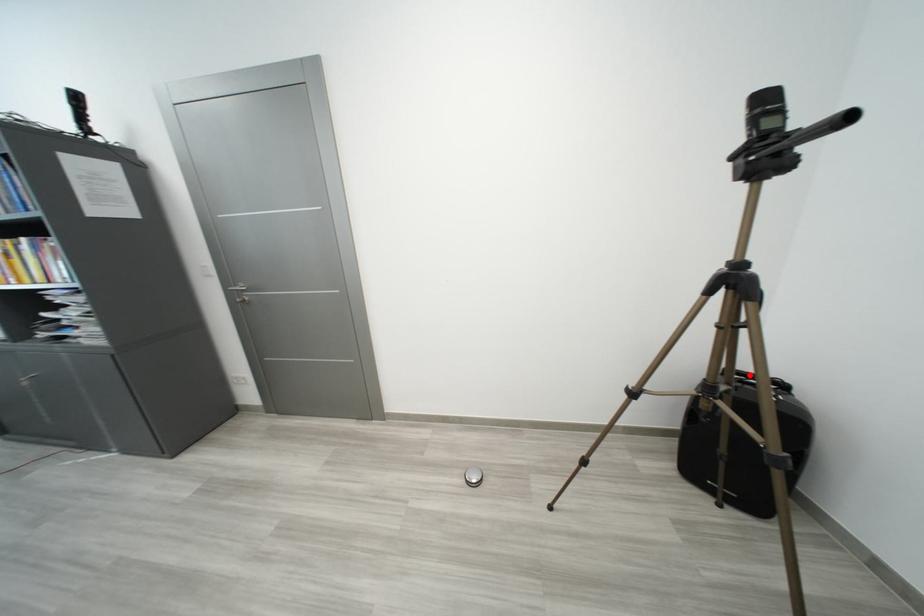
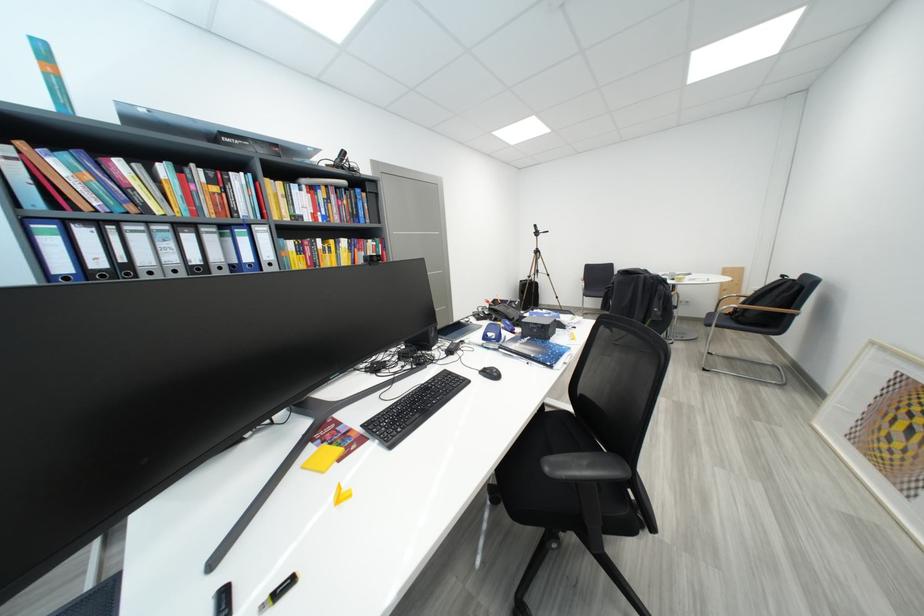
Question: I am providing you with two images of the same scene from different viewpoints. A red point is marked on the first image. Is the red point's position out of view in image 2?

Choices:
 (A) Yes
 (B) No

Answer: (A)